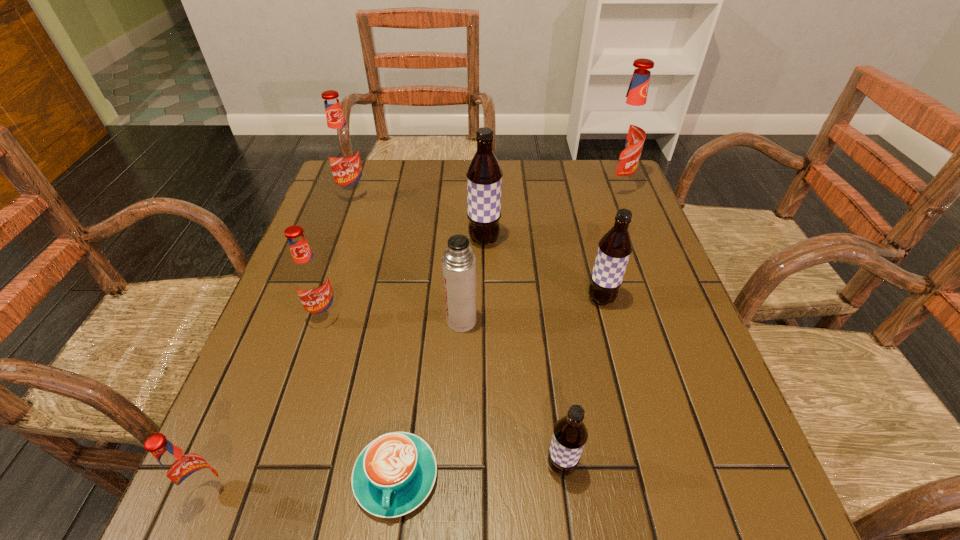
Locate an element on the screen. Image resolution: width=960 pixels, height=540 pixels. the third object from right to left is located at coordinates (570, 434).

Identify the location of the smallest red root beer. This screenshot has width=960, height=540. (187, 472).

Locate an element on the screen. the shortest object is located at coordinates (393, 475).

At what (x,y) coordinates should I click in order to perform the action: click on cappuccino. Please return your answer as a coordinate pair (x, y). Looking at the image, I should click on (393, 475).

Find the location of `free space located on the left of the rightmost red root beer`. free space located on the left of the rightmost red root beer is located at coordinates (471, 188).

This screenshot has height=540, width=960. Identify the location of vacant space located on the back of the third smallest red root beer. (367, 160).

I want to click on free space located 0.290m on the front of the leftmost brown root beer, so click(485, 346).

Locate an element on the screen. free location located 0.140m on the back of the third farthest red root beer is located at coordinates (343, 262).

I want to click on vacant region located 0.290m on the back of the second object from right to left, so [578, 212].

Locate an element on the screen. vacant point located on the left of the thermos bottle is located at coordinates (288, 321).